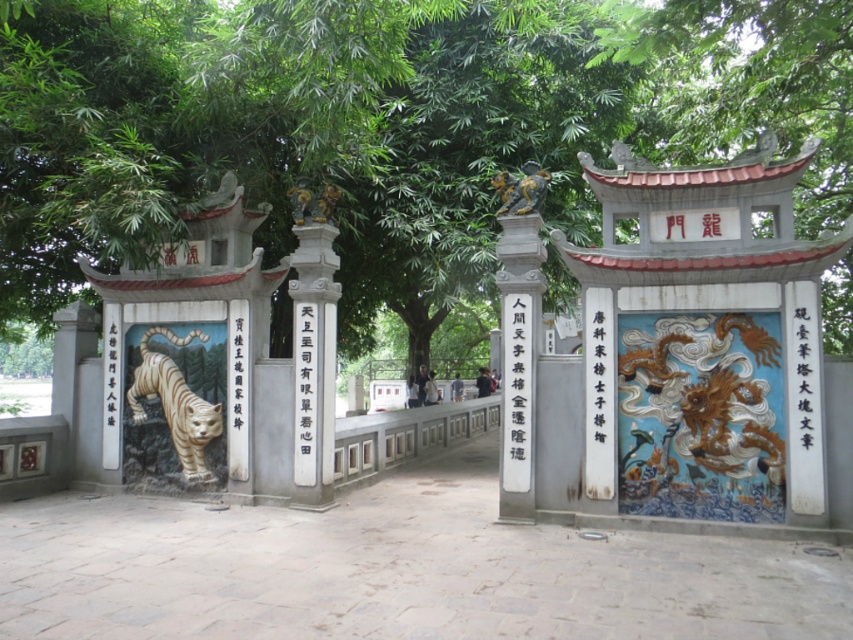
Is white glossy tiger at left in front of bronze statue at upper center?

No, it is behind bronze statue at upper center.

Is white glossy tiger at left wider than bronze statue at upper center?

Correct, the width of white glossy tiger at left exceeds that of bronze statue at upper center.

Is point (194, 371) closer to camera compared to point (502, 212)?

That is False.

Find the location of a particular element. The width and height of the screenshot is (853, 640). white glossy tiger at left is located at coordinates (173, 403).

Does green leafy tree at center have a greater width compared to white glossy tiger at left?

Yes, green leafy tree at center is wider than white glossy tiger at left.

Based on the photo, measure the distance between green leafy tree at center and camera.

A distance of 6.18 meters exists between green leafy tree at center and camera.

Is point (666, 113) behind point (137, 468)?

Yes, point (666, 113) is farther from viewer.

Where is `green leafy tree at center`? Image resolution: width=853 pixels, height=640 pixels. green leafy tree at center is located at coordinates (384, 122).

Is green leafy tree at center bigger than bronze statue at upper center?

Indeed, green leafy tree at center has a larger size compared to bronze statue at upper center.

Is green leafy tree at center above bronze statue at upper center?

Correct, green leafy tree at center is located above bronze statue at upper center.

Is point (425, 346) behind point (525, 182)?

Yes, it is.

Find the location of a particular element. The width and height of the screenshot is (853, 640). green leafy tree at center is located at coordinates (384, 122).